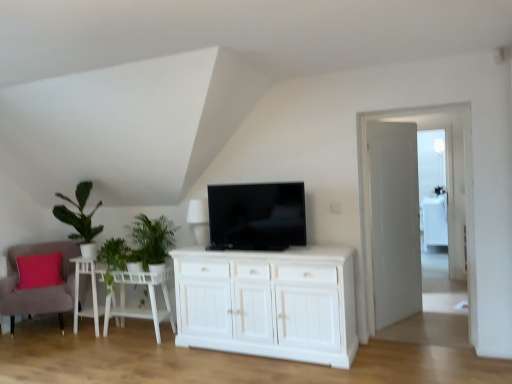
The height and width of the screenshot is (384, 512). I want to click on vacant area situated below transparent glass door at right, the first glass door viewed from the front (from a real-world perspective), so click(426, 337).